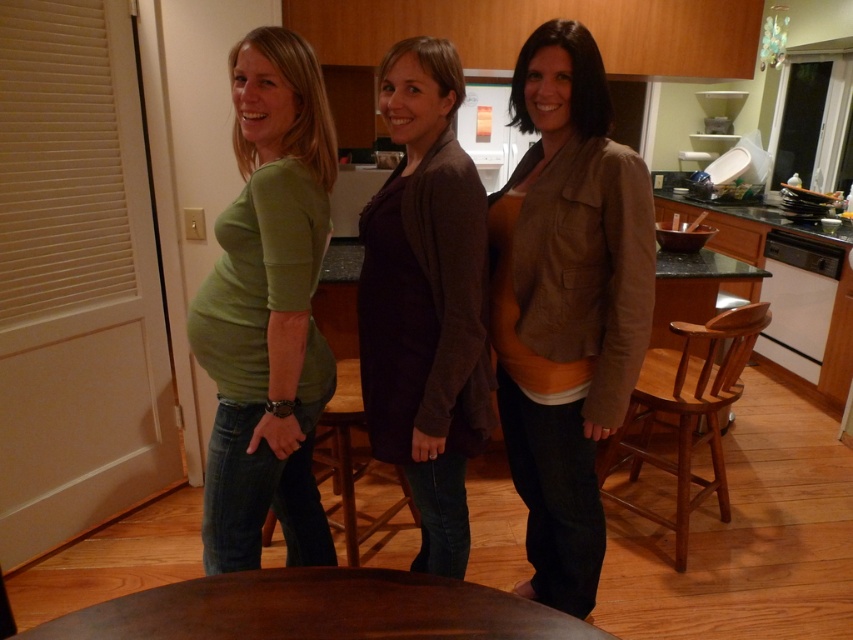
You are standing in the kitchen and want to place a large bowl on the brown wooden table at center. However, there is a brown cotton jacket at center in the way. Can you move the jacket to access the table?

The brown wooden table at center is behind the brown cotton jacket at center, so you can move the jacket to access the table.

You are a photographer standing in the kitchen and want to take a photo of the dark brown sweater at center and the brown wooden table at center. If your camera can only focus on objects within 20 inches of each other, will both objects be in focus?

The dark brown sweater at center and the brown wooden table at center are 22.39 inches apart, which is beyond the 20 inches focus range. Therefore, both objects cannot be in focus simultaneously.

You are a photographer setting up a shot in the kitchen. You need to ensure that the brown cotton jacket at center is visible above the brown wooden table at center. Based on the scene description, is this arrangement possible?

Yes, the arrangement is possible because the brown cotton jacket at center is located above the brown wooden table at center according to the description.